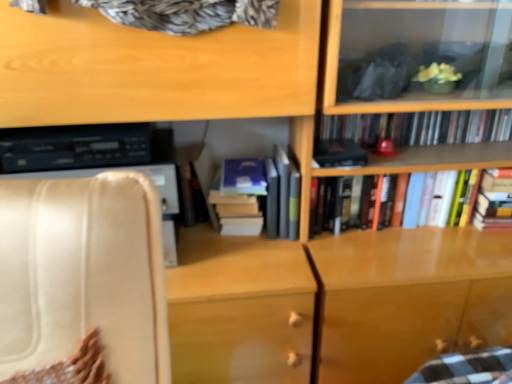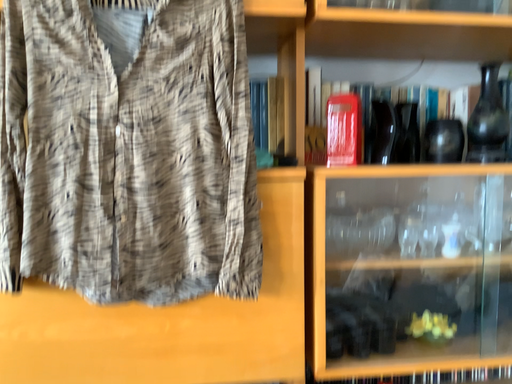
Question: How did the camera likely rotate when shooting the video?

Choices:
 (A) rotated downward
 (B) rotated upward

Answer: (B)